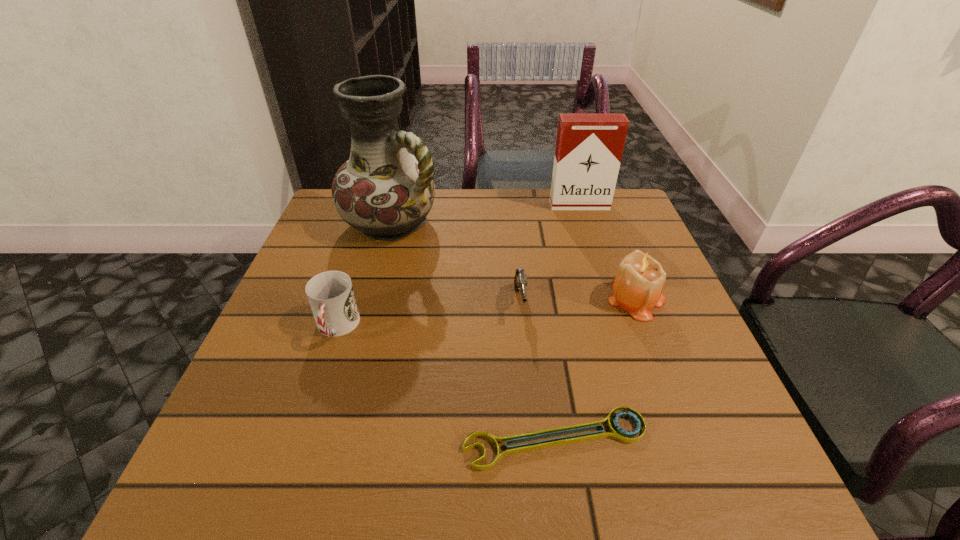
Where is `the fifth closest object to the cigarette_case`? the fifth closest object to the cigarette_case is located at coordinates (616, 432).

Point out which object is positioned as the fifth nearest to the nearest object. Please provide its 2D coordinates. Your answer should be formatted as a tuple, i.e. [(x, y)], where the tuple contains the x and y coordinates of a point satisfying the conditions above.

[(589, 147)]

You are a GUI agent. You are given a task and a screenshot of the screen. Output one action in this format:
    pyautogui.click(x=<x>, y=<y>)
    Task: Click on the vacant region that satisfies the following two spatial constraints: 1. on the side of the cup where the handle is located; 2. on the left side of the shortest object
    
    Given the screenshot: What is the action you would take?
    300,438

This screenshot has height=540, width=960. I want to click on vacant area that satisfies the following two spatial constraints: 1. at the barrel of the second shortest object; 2. on the left side of the wrench, so click(x=534, y=438).